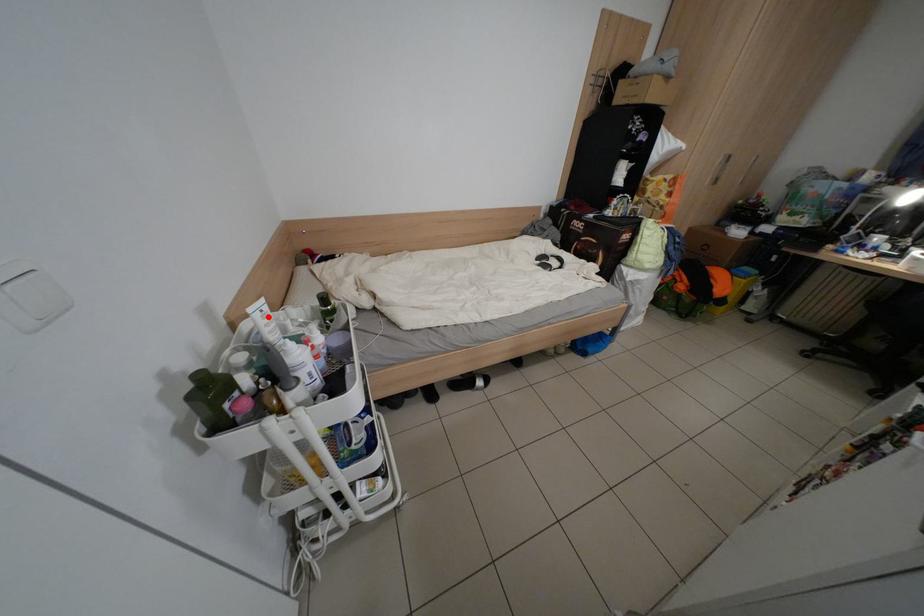
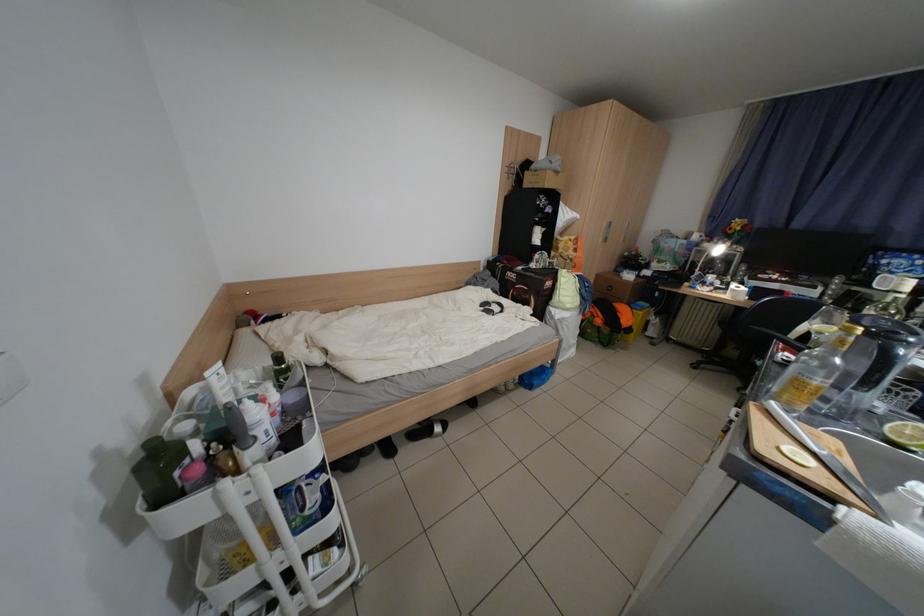
In the second image, find the point that corresponds to the highlighted location in the first image.

(225, 379)